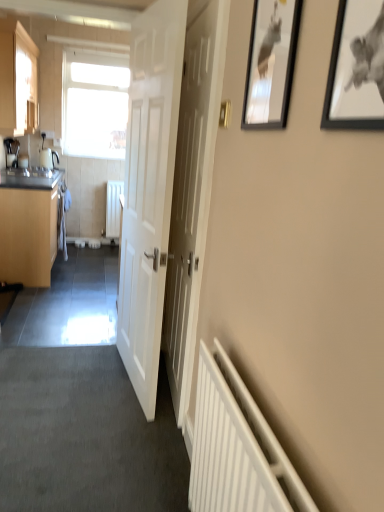
Question: From the image's perspective, is black glossy picture frame at upper right, the second picture frame in the right-to-left sequence, located above or below white wooden door at center, marked as the second door in a right-to-left arrangement?

Choices:
 (A) above
 (B) below

Answer: (A)

Question: Based on their sizes in the image, would you say black glossy picture frame at upper right, which appears as the first picture frame when viewed from the back, is bigger or smaller than white wooden door at center, which is the first door from left to right?

Choices:
 (A) small
 (B) big

Answer: (A)

Question: Based on their relative distances, which object is nearer to the black glossy picture frame at upper right, the second picture frame in the right-to-left sequence?

Choices:
 (A) matte wood cabinet at left, which is counted as the second cabinetry, starting from the top
 (B) white fabric laundry at left
 (C) white wooden door at center, marked as the second door in a right-to-left arrangement
 (D) white wooden door at center, placed as the 1th door when sorted from right to left
 (E) matte wood cabinet at upper left, the second cabinetry when ordered from bottom to top

Answer: (D)

Question: Considering the real-world distances, which object is farthest from the white fabric laundry at left?

Choices:
 (A) black glossy picture frame at upper right, the second picture frame in the right-to-left sequence
 (B) black matte picture frame at upper right, the 2th picture frame viewed from the back
 (C) transparent glass window at upper left
 (D) matte wood cabinet at left, which is counted as the second cabinetry, starting from the top
 (E) white wooden door at center, which is the first door from left to right

Answer: (B)